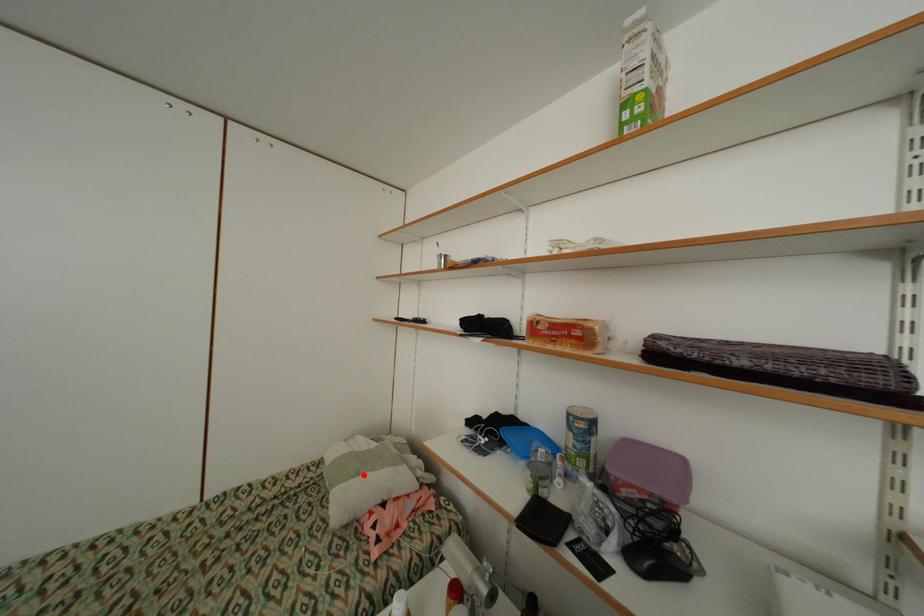
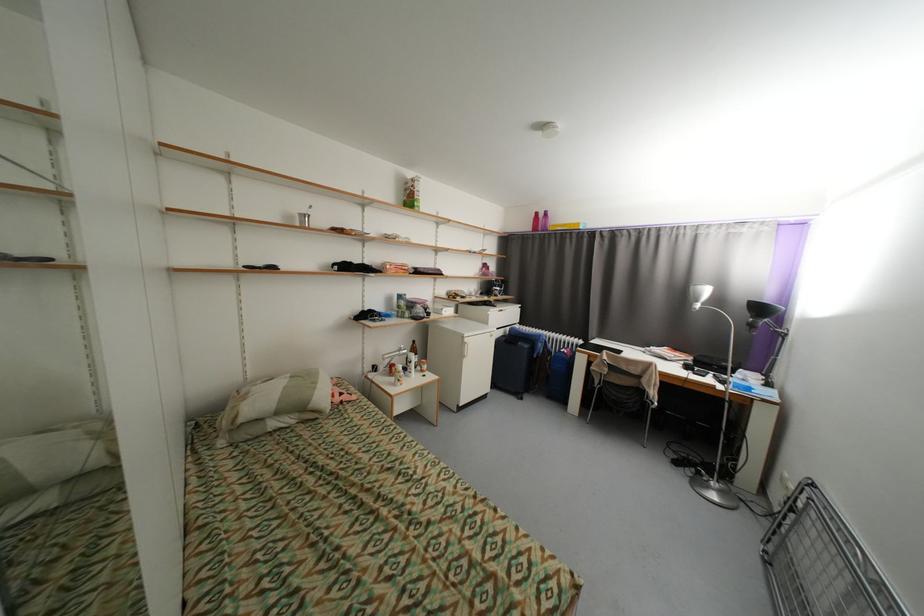
Find the pixel in the second image that matches the highlighted location in the first image.

(322, 384)